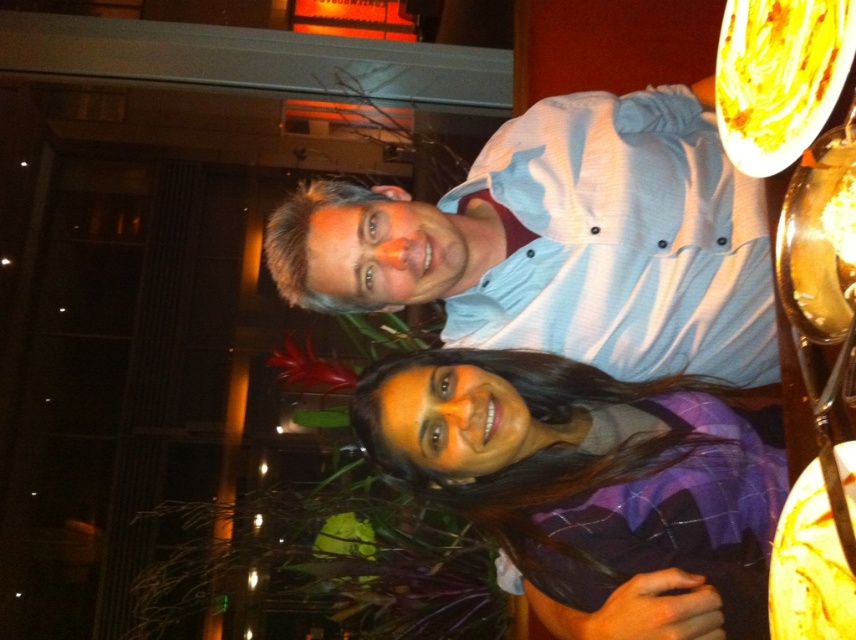
Question: In this image, where is light blue button-up shirt at center located relative to purple plaid shirt at center?

Choices:
 (A) above
 (B) below

Answer: (A)

Question: Can you confirm if light blue button-up shirt at center is positioned to the left of purple plaid shirt at center?

Choices:
 (A) yes
 (B) no

Answer: (A)

Question: Which point is closer to the camera?

Choices:
 (A) (456, 323)
 (B) (598, 488)

Answer: (B)

Question: Which of the following is the closest to the observer?

Choices:
 (A) (638, 432)
 (B) (590, 269)

Answer: (A)

Question: Does light blue button-up shirt at center have a larger size compared to purple plaid shirt at center?

Choices:
 (A) yes
 (B) no

Answer: (A)